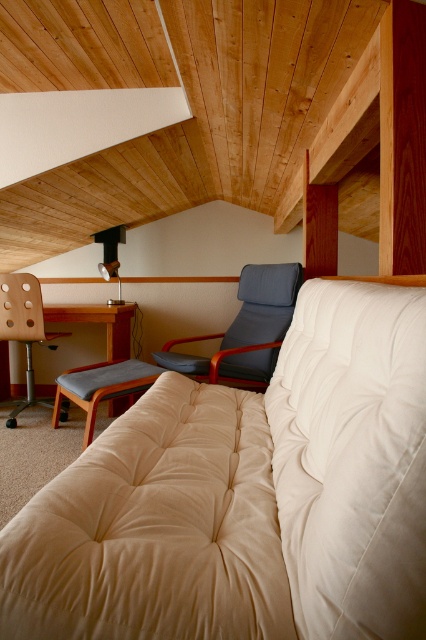
This screenshot has width=426, height=640. What do you see at coordinates (101, 387) in the screenshot? I see `gray fabric stool at center` at bounding box center [101, 387].

Can you confirm if gray fabric stool at center is smaller than wooden desk at left?

No, gray fabric stool at center is not smaller than wooden desk at left.

The width and height of the screenshot is (426, 640). I want to click on gray fabric stool at center, so click(x=101, y=387).

Which of these two, matte wood armchair at left or wooden desk at left, stands taller?

matte wood armchair at left

Does point (11, 291) come behind point (127, 355)?

No, (11, 291) is in front of (127, 355).

Is point (0, 294) behind point (66, 317)?

No, (0, 294) is closer to viewer.

At what (x,y) coordinates should I click in order to perform the action: click on matte wood armchair at left. Please return your answer as a coordinate pair (x, y). Looking at the image, I should click on (23, 330).

Is beige fabric couch at center taller than matte wood armchair at left?

In fact, beige fabric couch at center may be shorter than matte wood armchair at left.

Between beige fabric couch at center and matte wood armchair at left, which one has more height?

matte wood armchair at left

Which is behind, point (51, 570) or point (40, 342)?

The point (40, 342) is more distant.

Locate an element on the screen. Image resolution: width=426 pixels, height=640 pixels. beige fabric couch at center is located at coordinates (245, 497).